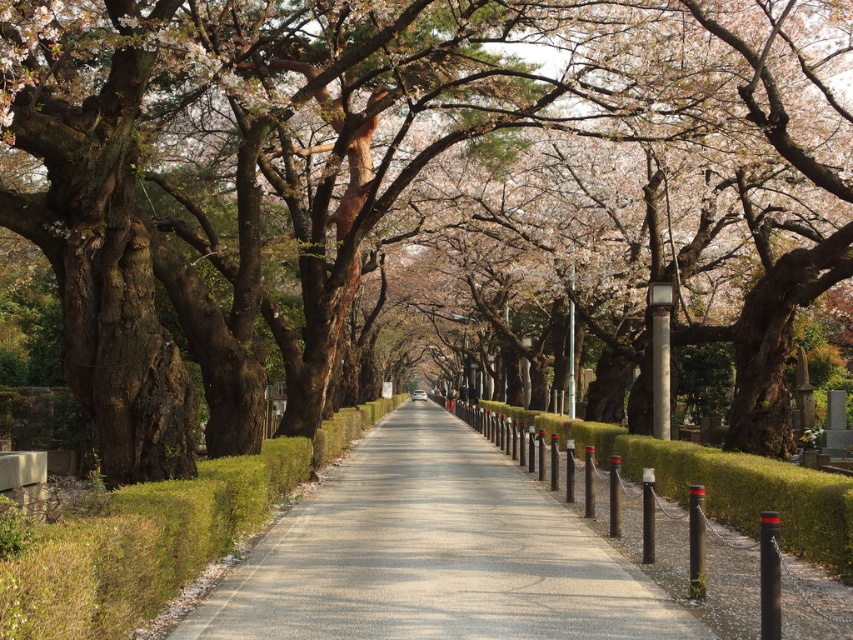
Question: In this image, where is smooth concrete pavement at center located relative to green grassy hedge at center?

Choices:
 (A) below
 (B) above

Answer: (A)

Question: Which object is closer to the camera taking this photo?

Choices:
 (A) green grassy hedge at center
 (B) smooth concrete pavement at center

Answer: (A)

Question: Which of the following is the farthest from the observer?

Choices:
 (A) smooth concrete pavement at center
 (B) green grassy hedge at center

Answer: (A)

Question: Does smooth concrete pavement at center come behind green grassy hedge at center?

Choices:
 (A) no
 (B) yes

Answer: (B)

Question: Which point is farther from the camera taking this photo?

Choices:
 (A) (511, 566)
 (B) (146, 529)

Answer: (A)

Question: Where is smooth concrete pavement at center located in relation to green grassy hedge at center in the image?

Choices:
 (A) above
 (B) below

Answer: (B)